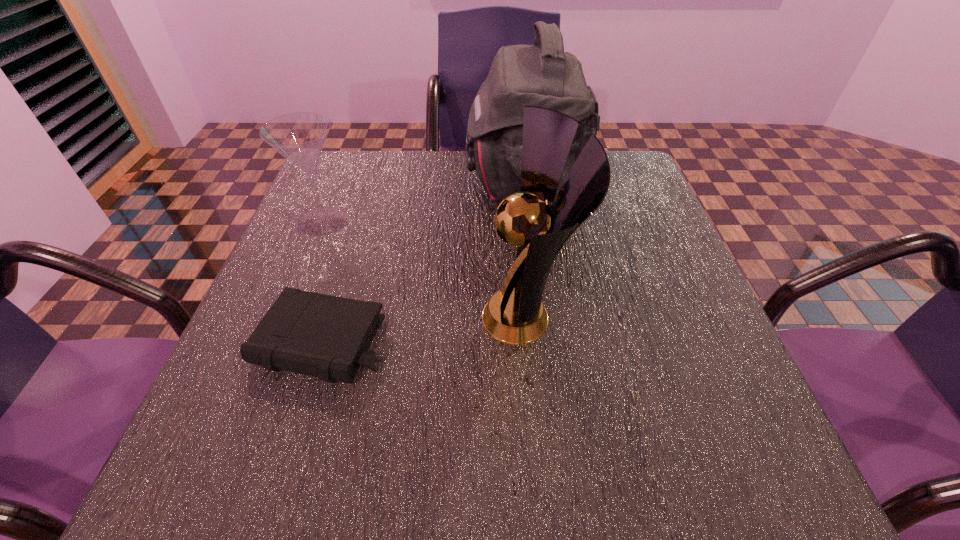
This screenshot has height=540, width=960. What are the coordinates of `vacant space situated on the front of the third tallest object` in the screenshot? It's located at (308, 258).

Locate an element on the screen. This screenshot has width=960, height=540. free location located 0.370m on the back of the Bible is located at coordinates (370, 192).

What are the coordinates of `object that is at the far edge` in the screenshot? It's located at (543, 75).

Locate an element on the screen. The height and width of the screenshot is (540, 960). flute glass that is at the left edge is located at coordinates (299, 137).

In order to click on Bible at the left edge in this screenshot , I will do `click(324, 336)`.

Identify the location of object that is positioned at the right edge. (543, 75).

Where is `object that is at the far right corner`? object that is at the far right corner is located at coordinates (543, 75).

The width and height of the screenshot is (960, 540). In the image, there is a desktop. In order to click on vacant area at the far edge in this screenshot , I will do `click(457, 156)`.

Image resolution: width=960 pixels, height=540 pixels. I want to click on free region at the near edge of the desktop, so click(478, 489).

You are a GUI agent. You are given a task and a screenshot of the screen. Output one action in this format:
    pyautogui.click(x=<x>, y=<y>)
    Task: Click on the free space at the near right corner of the desktop
    
    Given the screenshot: What is the action you would take?
    pyautogui.click(x=750, y=464)